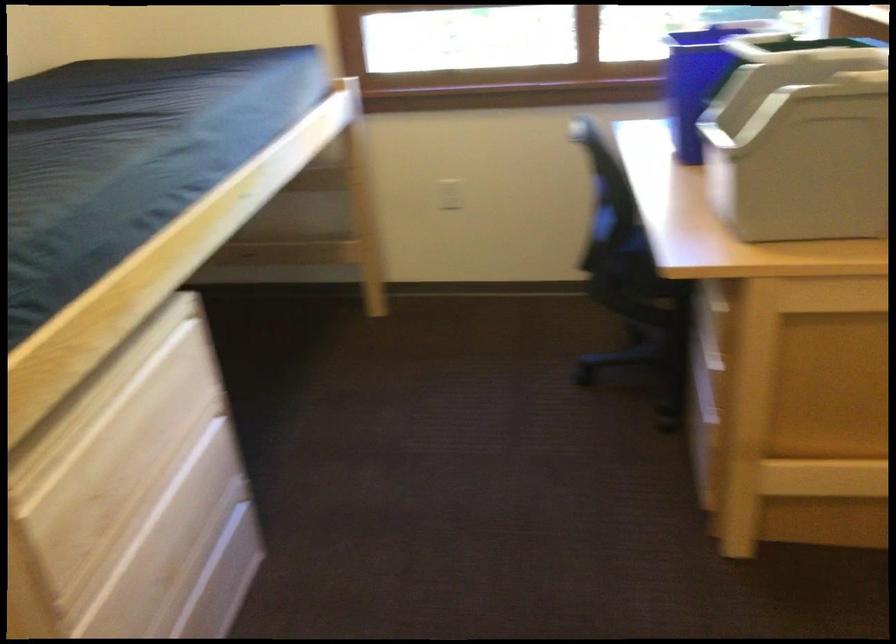
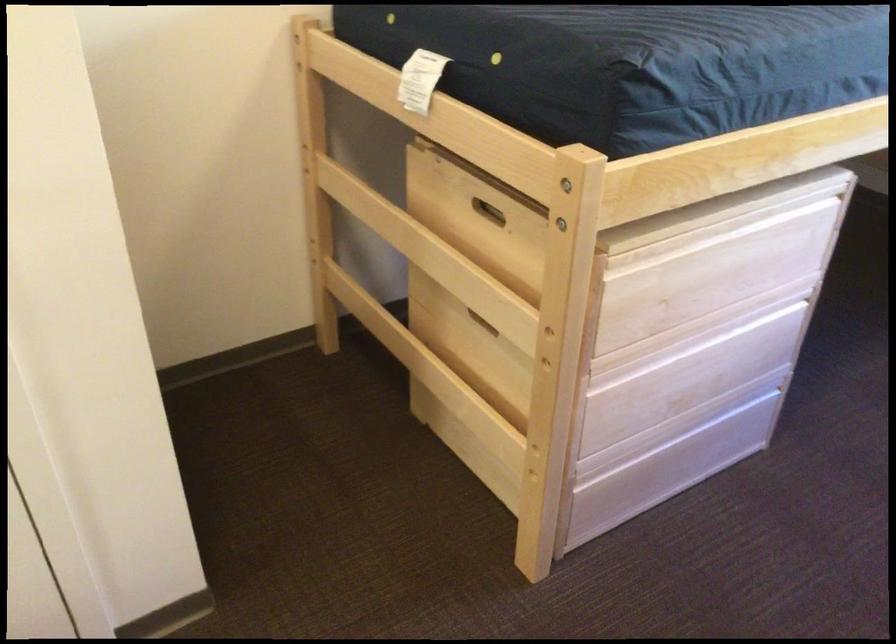
In the second image, find the point that corresponds to point 169,496 in the first image.

(718, 342)